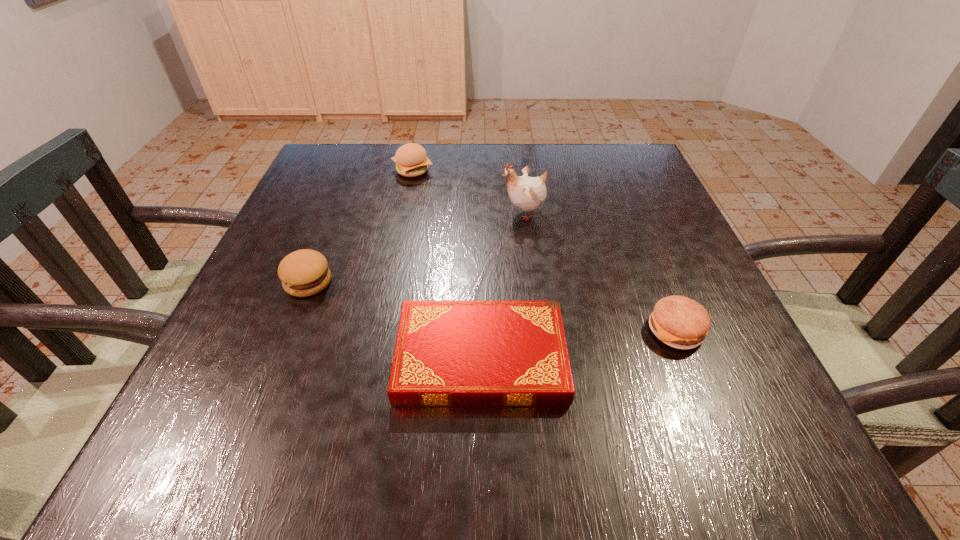
Find the location of `vacant area that lies between the tallest object and the second hamburger from right to left`. vacant area that lies between the tallest object and the second hamburger from right to left is located at coordinates (468, 192).

Where is `free space between the second hamburger from right to left and the hardback book`? Image resolution: width=960 pixels, height=540 pixels. free space between the second hamburger from right to left and the hardback book is located at coordinates (446, 264).

Where is `empty space that is in between the hardback book and the leftmost object`? The width and height of the screenshot is (960, 540). empty space that is in between the hardback book and the leftmost object is located at coordinates (395, 320).

Find the location of a particular element. The width and height of the screenshot is (960, 540). free space between the rightmost object and the tallest object is located at coordinates (600, 272).

Where is `vacant area between the tallest object and the leftmost hamburger`? The height and width of the screenshot is (540, 960). vacant area between the tallest object and the leftmost hamburger is located at coordinates (417, 247).

I want to click on vacant area that lies between the shortest object and the farthest hamburger, so click(x=446, y=264).

You are a GUI agent. You are given a task and a screenshot of the screen. Output one action in this format:
    pyautogui.click(x=<x>, y=<y>)
    Task: Click on the empty space between the shortest object and the farthest object
    The height and width of the screenshot is (540, 960).
    Given the screenshot: What is the action you would take?
    pyautogui.click(x=446, y=264)

Image resolution: width=960 pixels, height=540 pixels. Identify the location of vacant region between the rightmost object and the bird. (600, 272).

Select which object is the closest to the third nearest object. Please provide its 2D coordinates. Your answer should be formatted as a tuple, i.e. [(x, y)], where the tuple contains the x and y coordinates of a point satisfying the conditions above.

[(448, 353)]

Locate which object is the fourth closest to the hardback book. Please provide its 2D coordinates. Your answer should be formatted as a tuple, i.e. [(x, y)], where the tuple contains the x and y coordinates of a point satisfying the conditions above.

[(411, 160)]